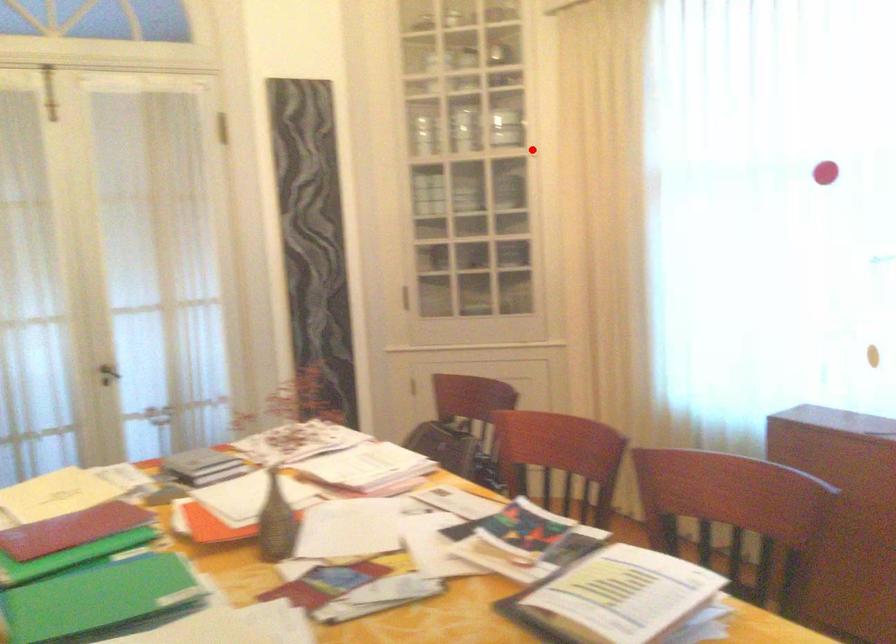
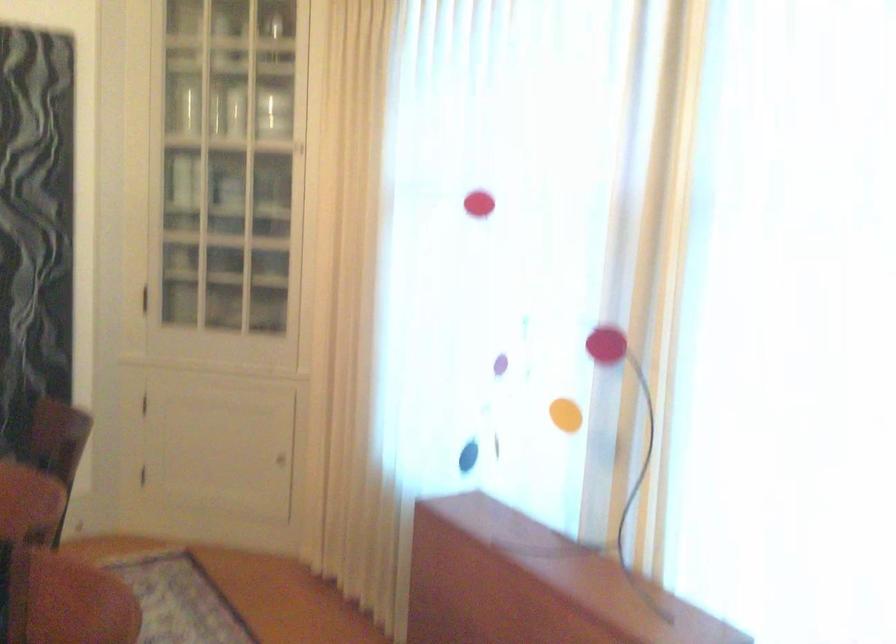
In the second image, find the point that corresponds to the highlighted location in the first image.

(298, 147)